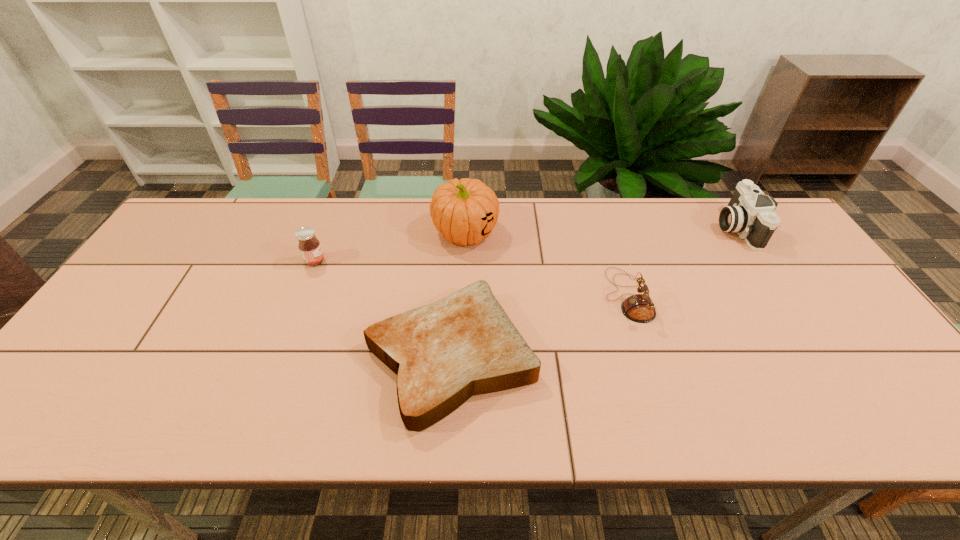
Find the location of a particular element. The image size is (960, 540). free spot between the second tallest object and the shortest object is located at coordinates (593, 292).

Locate an element on the screen. This screenshot has width=960, height=540. vacant area that lies between the bread and the jam is located at coordinates (383, 308).

Select which object is the closest to the rightmost object. Please provide its 2D coordinates. Your answer should be formatted as a tuple, i.e. [(x, y)], where the tuple contains the x and y coordinates of a point satisfying the conditions above.

[(639, 308)]

Identify which object is the third closest to the leftmost object. Please provide its 2D coordinates. Your answer should be formatted as a tuple, i.e. [(x, y)], where the tuple contains the x and y coordinates of a point satisfying the conditions above.

[(639, 308)]

Locate an element on the screen. vacant position in the image that satisfies the following two spatial constraints: 1. on the surface of the pumpkin; 2. on the label side of the third shortest object is located at coordinates tap(465, 261).

The image size is (960, 540). Identify the location of free space that satisfies the following two spatial constraints: 1. on the front side of the rightmost object; 2. on the label side of the jam. (758, 261).

You are a GUI agent. You are given a task and a screenshot of the screen. Output one action in this format:
    pyautogui.click(x=<x>, y=<y>)
    Task: Click on the free spot that satisfies the following two spatial constraints: 1. on the surface of the tallest object; 2. on the label side of the jam
    
    Given the screenshot: What is the action you would take?
    pyautogui.click(x=465, y=261)

Image resolution: width=960 pixels, height=540 pixels. I want to click on vacant space that satisfies the following two spatial constraints: 1. on the label side of the shortest object; 2. on the left side of the jam, so tap(278, 356).